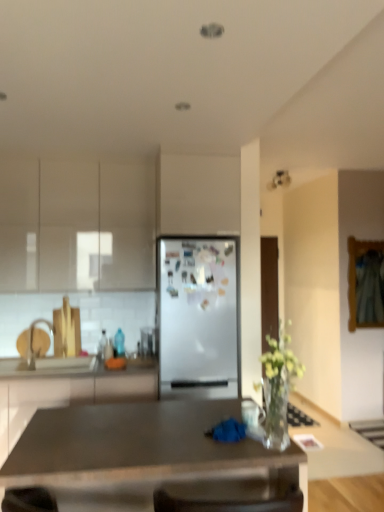
Question: From the image's perspective, is white glossy cabinet at left, acting as the second cabinetry starting from the top, located above or below clear glass vase at center?

Choices:
 (A) below
 (B) above

Answer: (A)

Question: Is point (56, 401) positioned closer to the camera than point (281, 422)?

Choices:
 (A) farther
 (B) closer

Answer: (A)

Question: Estimate the real-world distances between objects in this image. Which object is farther from the matte gray desk at center?

Choices:
 (A) matte white cabinets at upper left, which is counted as the first cabinetry, starting from the top
 (B) white glossy countertop at lower left
 (C) white glossy cabinet at left, the first cabinetry in the bottom-to-top sequence
 (D) white matte refrigerator at center
 (E) clear glass vase at center

Answer: (A)

Question: Considering the real-world distances, which object is closest to the clear glass vase at center?

Choices:
 (A) matte white cabinets at upper left, which is counted as the first cabinetry, starting from the top
 (B) white glossy countertop at lower left
 (C) white glossy cabinet at left, the first cabinetry in the bottom-to-top sequence
 (D) white matte refrigerator at center
 (E) matte gray desk at center

Answer: (E)